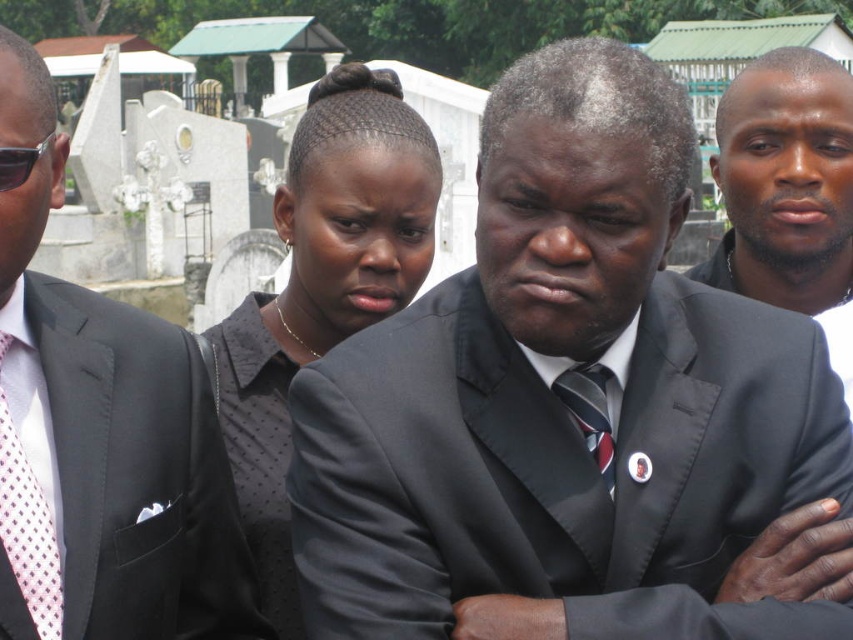
You are attending a funeral and need to identify the person wearing the black matte suit at center and the pink dotted tie at left. Which one is taller?

The black matte suit at center is taller than the pink dotted tie at left.

You are organizing a photo shoot and need to ensure that the black matte suit at center and the matte black suit at center are positioned so that the wider one is on the left side of the frame. Based on the scene description, which suit should be placed on the left?

The black matte suit at center should be placed on the left side of the frame since it might be wider than the matte black suit at center.

You are attending a funeral and need to identify the person wearing the larger suit. Which one is it between the black matte suit at center and the matte black suit at center?

The black matte suit at center has a larger size compared to the matte black suit at center, so the person wearing the larger suit is the one with the black matte suit at center.